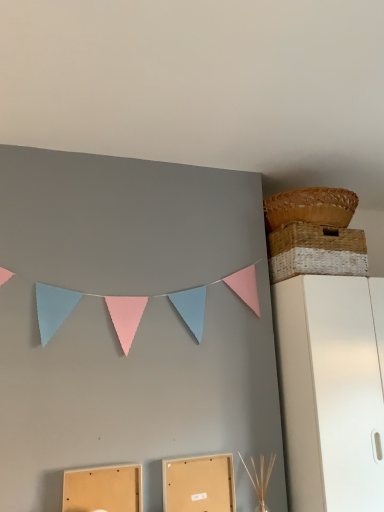
Question: Which direction should I rotate to look at matte cardboard box at lower center, which is the 1th cardboard box in left-to-right order, — up or down?

Choices:
 (A) up
 (B) down

Answer: (B)

Question: Can you confirm if matte cardboard box at lower center, which is the 1th cardboard box in left-to-right order, is shorter than white matte cabinet at right?

Choices:
 (A) no
 (B) yes

Answer: (B)

Question: Does matte cardboard box at lower center, which is the 1th cardboard box in left-to-right order, come behind white matte cabinet at right?

Choices:
 (A) yes
 (B) no

Answer: (B)

Question: Is matte cardboard box at lower center, the 2th cardboard box viewed from the right, facing towards white matte cabinet at right?

Choices:
 (A) no
 (B) yes

Answer: (A)

Question: Does matte cardboard box at lower center, the 2th cardboard box viewed from the right, have a smaller size compared to white matte cabinet at right?

Choices:
 (A) no
 (B) yes

Answer: (B)

Question: Considering the relative sizes of matte cardboard box at lower center, which is the 1th cardboard box in left-to-right order, and white matte cabinet at right in the image provided, is matte cardboard box at lower center, which is the 1th cardboard box in left-to-right order, wider than white matte cabinet at right?

Choices:
 (A) yes
 (B) no

Answer: (B)

Question: From a real-world perspective, is matte cardboard box at lower center, which is the 1th cardboard box in left-to-right order, on white matte cabinet at right?

Choices:
 (A) no
 (B) yes

Answer: (A)

Question: From a real-world perspective, is woven brown basket at upper right, which appears as the first basket when viewed from the top, located beneath matte cardboard box at lower center, which is the 1th cardboard box in left-to-right order?

Choices:
 (A) yes
 (B) no

Answer: (B)

Question: Is woven brown basket at upper right, which appears as the 2th basket when ordered from the bottom, with matte cardboard box at lower center, the 2th cardboard box viewed from the right?

Choices:
 (A) yes
 (B) no

Answer: (B)

Question: From a real-world perspective, is woven brown basket at upper right, which appears as the first basket when viewed from the top, over matte cardboard box at lower center, the 2th cardboard box viewed from the right?

Choices:
 (A) no
 (B) yes

Answer: (B)

Question: Does woven brown basket at upper right, which appears as the first basket when viewed from the top, have a greater height compared to matte cardboard box at lower center, which is the 1th cardboard box in left-to-right order?

Choices:
 (A) no
 (B) yes

Answer: (A)

Question: Is woven brown basket at upper right, which appears as the 2th basket when ordered from the bottom, closer to camera compared to matte cardboard box at lower center, the 2th cardboard box viewed from the right?

Choices:
 (A) yes
 (B) no

Answer: (B)

Question: Is woven brown basket at upper right, which appears as the first basket when viewed from the top, further to camera compared to matte cardboard box at lower center, the 2th cardboard box viewed from the right?

Choices:
 (A) yes
 (B) no

Answer: (A)

Question: Does woven natural basket at upper right, which is counted as the 1th basket, starting from the bottom, come in front of woven brown basket at upper right, which appears as the 2th basket when ordered from the bottom?

Choices:
 (A) no
 (B) yes

Answer: (B)